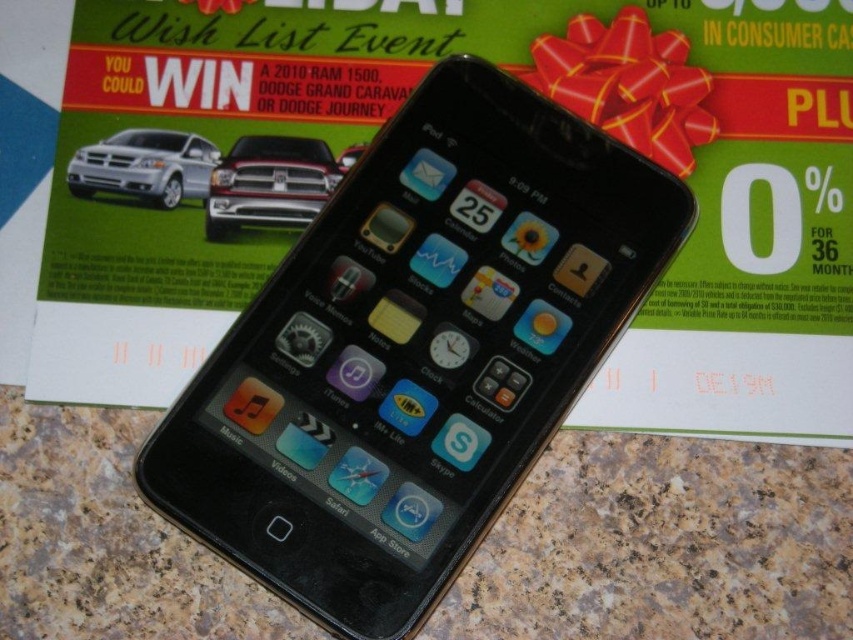
Question: Can you confirm if brown marble counter top at lower center is positioned to the right of silver metallic car at upper left?

Choices:
 (A) yes
 (B) no

Answer: (A)

Question: Which of the following is the farthest from the observer?

Choices:
 (A) (35, 625)
 (B) (190, 148)
 (C) (347, 218)
 (D) (345, 148)

Answer: (D)

Question: Can you confirm if brown marble counter top at lower center is thinner than matte black truck at center?

Choices:
 (A) yes
 (B) no

Answer: (B)

Question: Which point is closer to the camera taking this photo?

Choices:
 (A) (352, 148)
 (B) (184, 157)
 (C) (624, 259)
 (D) (743, 630)

Answer: (D)

Question: Which is nearer to the black plastic smartphone at center?

Choices:
 (A) matte black truck at upper center
 (B) silver metallic car at upper left
 (C) matte black truck at center
 (D) brown marble counter top at lower center

Answer: (D)

Question: Is brown marble counter top at lower center below matte black truck at center?

Choices:
 (A) yes
 (B) no

Answer: (A)